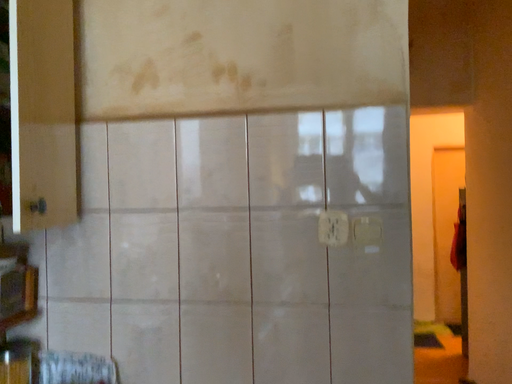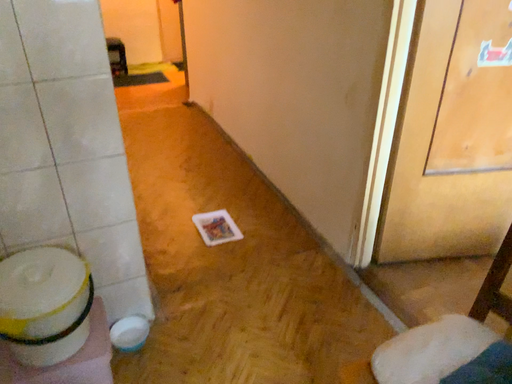
Question: How did the camera likely rotate when shooting the video?

Choices:
 (A) rotated downward
 (B) rotated upward

Answer: (A)